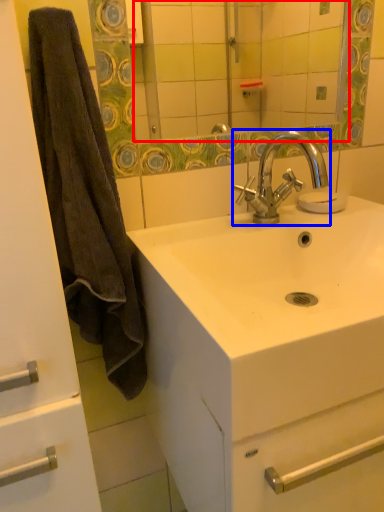
Question: Which object appears closest to the camera in this image, mirror (highlighted by a red box) or tap (highlighted by a blue box)?

Choices:
 (A) mirror
 (B) tap

Answer: (B)